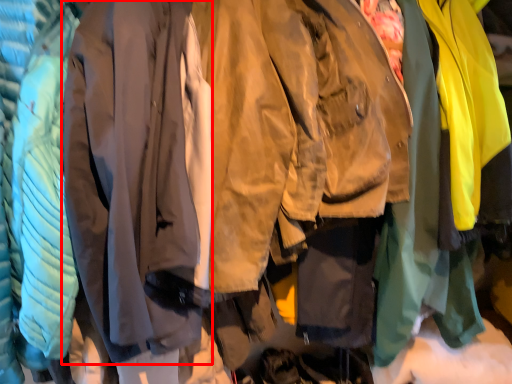
Question: From the image's perspective, considering the relative positions of sweatshirt (annotated by the red box) and sweatshirt in the image provided, where is sweatshirt (annotated by the red box) located with respect to the staircase?

Choices:
 (A) below
 (B) above

Answer: (A)